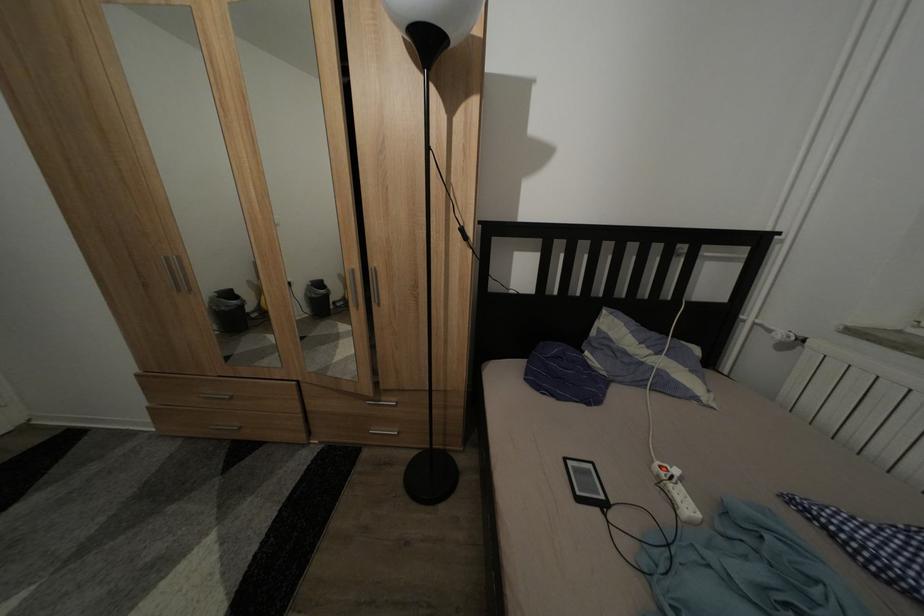
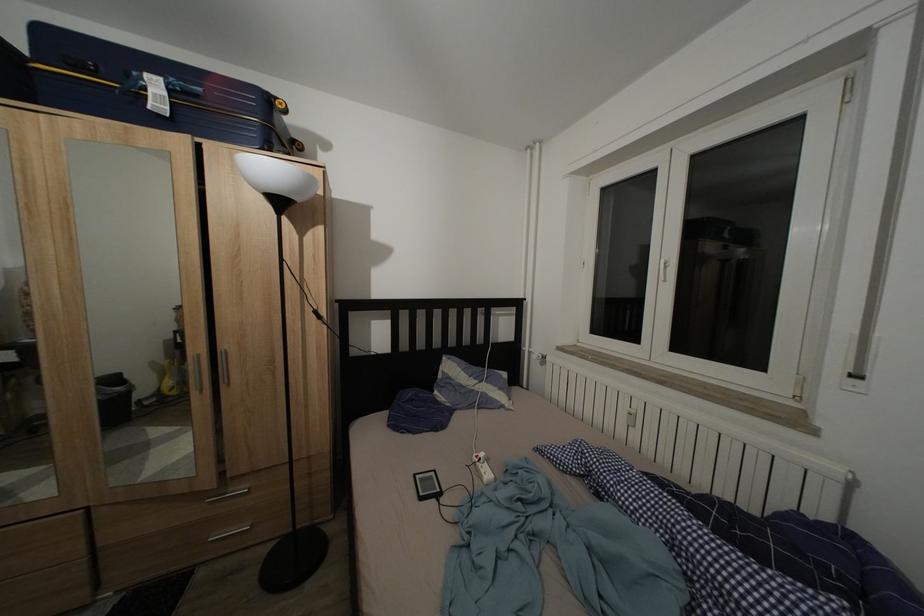
The point at (391, 405) is marked in the first image. Where is the corresponding point in the second image?

(237, 496)